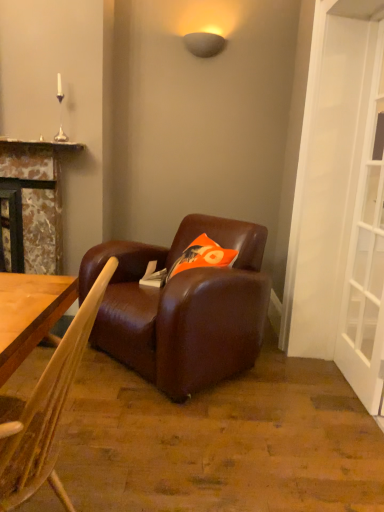
Question: Considering the relative sizes of orange fabric pillow at center and white glass screen door at right in the image provided, is orange fabric pillow at center shorter than white glass screen door at right?

Choices:
 (A) no
 (B) yes

Answer: (B)

Question: Is orange fabric pillow at center bigger than white glass screen door at right?

Choices:
 (A) no
 (B) yes

Answer: (A)

Question: Is orange fabric pillow at center not inside white glass screen door at right?

Choices:
 (A) yes
 (B) no

Answer: (A)

Question: Is orange fabric pillow at center in contact with white glass screen door at right?

Choices:
 (A) yes
 (B) no

Answer: (B)

Question: Can you confirm if orange fabric pillow at center is wider than white glass screen door at right?

Choices:
 (A) no
 (B) yes

Answer: (B)

Question: Can you confirm if orange fabric pillow at center is thinner than white glass screen door at right?

Choices:
 (A) yes
 (B) no

Answer: (B)

Question: Does orange fabric pillow at center lie behind brown leather chair at center?

Choices:
 (A) no
 (B) yes

Answer: (B)

Question: Is orange fabric pillow at center to the right of brown leather chair at center from the viewer's perspective?

Choices:
 (A) yes
 (B) no

Answer: (A)

Question: Is orange fabric pillow at center closer to the viewer compared to brown leather chair at center?

Choices:
 (A) yes
 (B) no

Answer: (B)

Question: From a real-world perspective, is orange fabric pillow at center below brown leather chair at center?

Choices:
 (A) yes
 (B) no

Answer: (B)

Question: Considering the relative sizes of orange fabric pillow at center and brown leather chair at center in the image provided, is orange fabric pillow at center smaller than brown leather chair at center?

Choices:
 (A) yes
 (B) no

Answer: (A)

Question: From a real-world perspective, is orange fabric pillow at center on brown leather chair at center?

Choices:
 (A) yes
 (B) no

Answer: (A)

Question: Could you tell me if brown leather chair at center is facing orange fabric pillow at center?

Choices:
 (A) yes
 (B) no

Answer: (B)